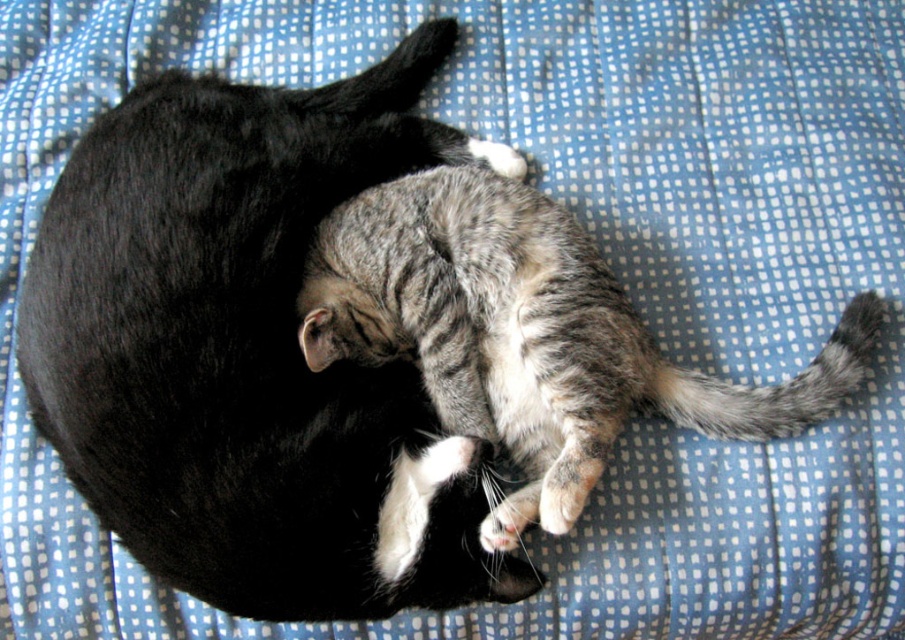
Does soft fur cat at center appear on the right side of gray striped fur cat at center?

In fact, soft fur cat at center is to the left of gray striped fur cat at center.

Can you confirm if soft fur cat at center is wider than gray striped fur cat at center?

In fact, soft fur cat at center might be narrower than gray striped fur cat at center.

Locate an element on the screen. Image resolution: width=905 pixels, height=640 pixels. soft fur cat at center is located at coordinates coord(250,352).